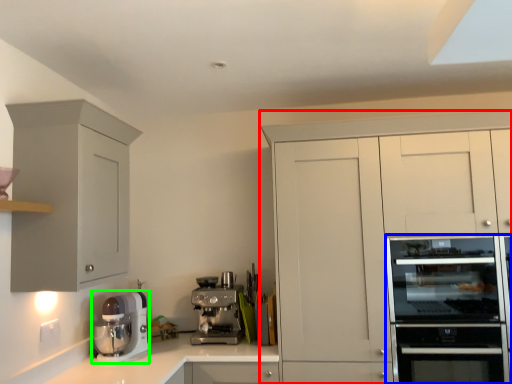
Question: Which object is positioned farthest from cabinetry (highlighted by a red box)? Select from home appliance (highlighted by a blue box) and kitchen appliance (highlighted by a green box).

Choices:
 (A) home appliance
 (B) kitchen appliance

Answer: (B)